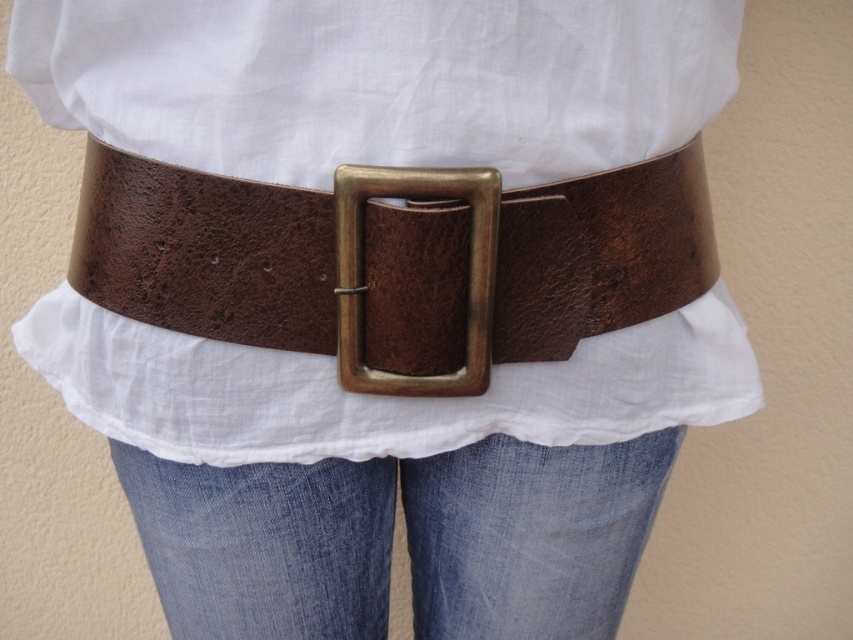
You are a fashion designer examining a model wearing a white cotton shirt at center and an antique brass buckle at center. Which item is located more to the left?

The white cotton shirt at center is positioned on the left side of antique brass buckle at center, so it is more to the left.

You are trying to decide if the brown leather belt at center can fit through the antique brass buckle at center. Based on their sizes, will it fit?

The brown leather belt at center might be wider than antique brass buckle at center, so it may not fit properly through the buckle.

You are a tailor adjusting the fit of a belt for a customer. The customer wants to ensure the antique brass buckle at center doesn not catch on the white cotton shirt at center. Based on the image, should the tailor make any adjustments to prevent this issue?

The white cotton shirt at center is located above the antique brass buckle at center, so the buckle is positioned below the shirt. This placement likely reduces the risk of the buckle catching on the shirt. No adjustments are needed unless the customer desires a different positioning.